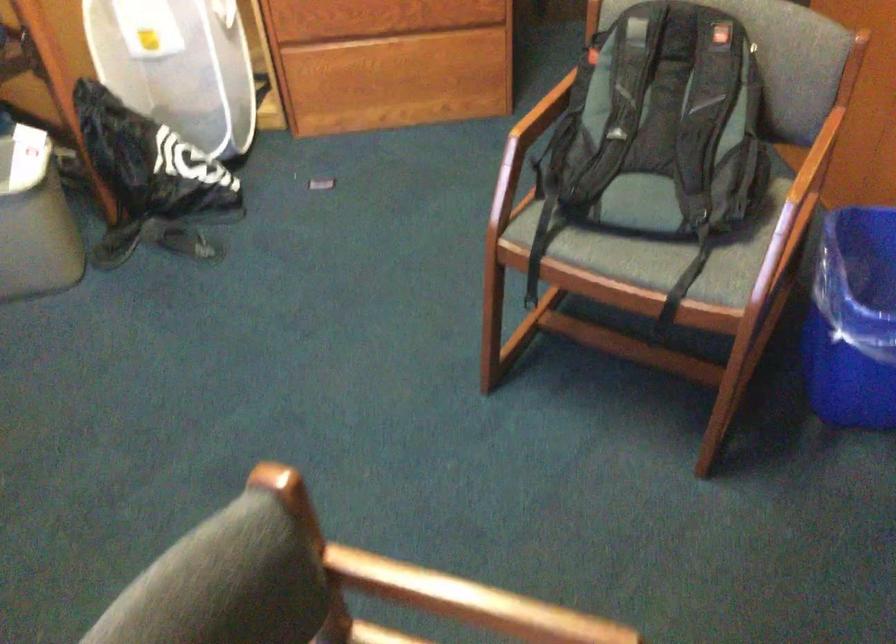
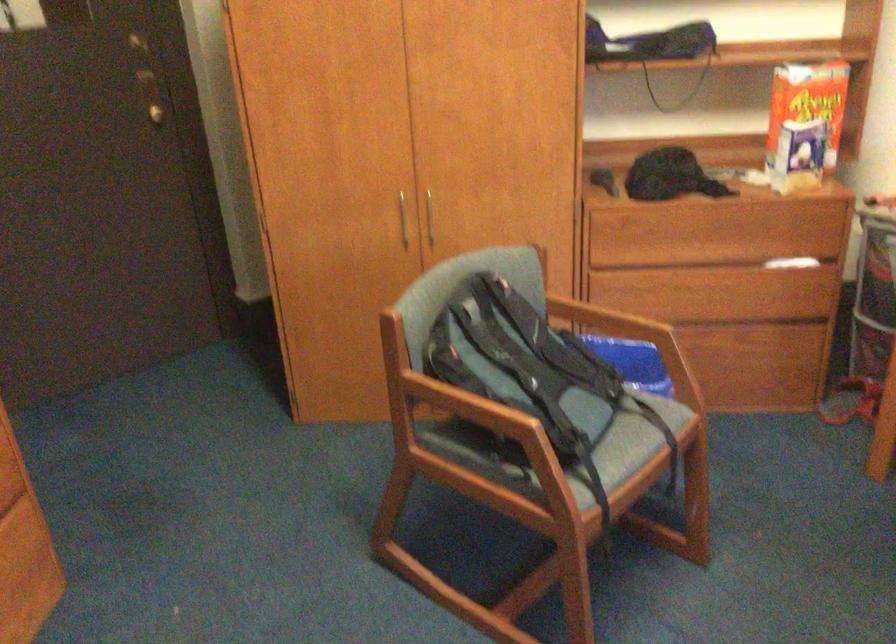
Where in the second image is the point corresponding to [677,281] from the first image?

(631, 444)